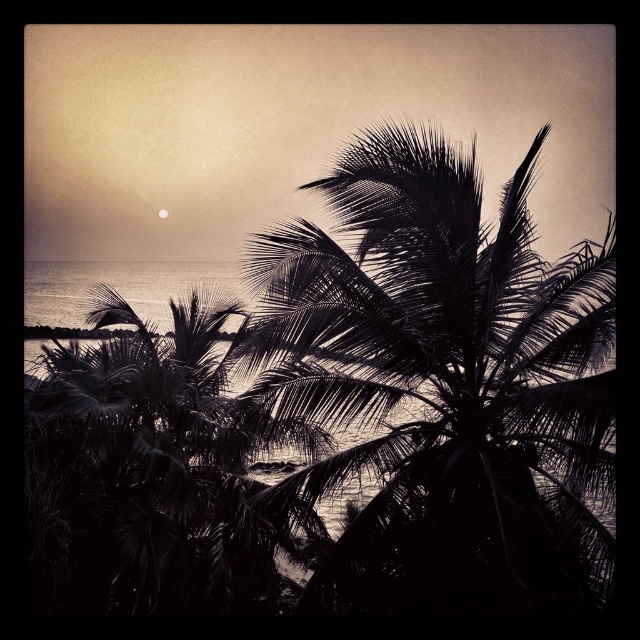
Does black leafy palm at center appear over silvery metallic moon at upper center?

No, black leafy palm at center is not above silvery metallic moon at upper center.

Does point (536, 461) come behind point (164, 216)?

No, (536, 461) is closer to viewer.

Locate an element on the screen. black leafy palm at center is located at coordinates (444, 385).